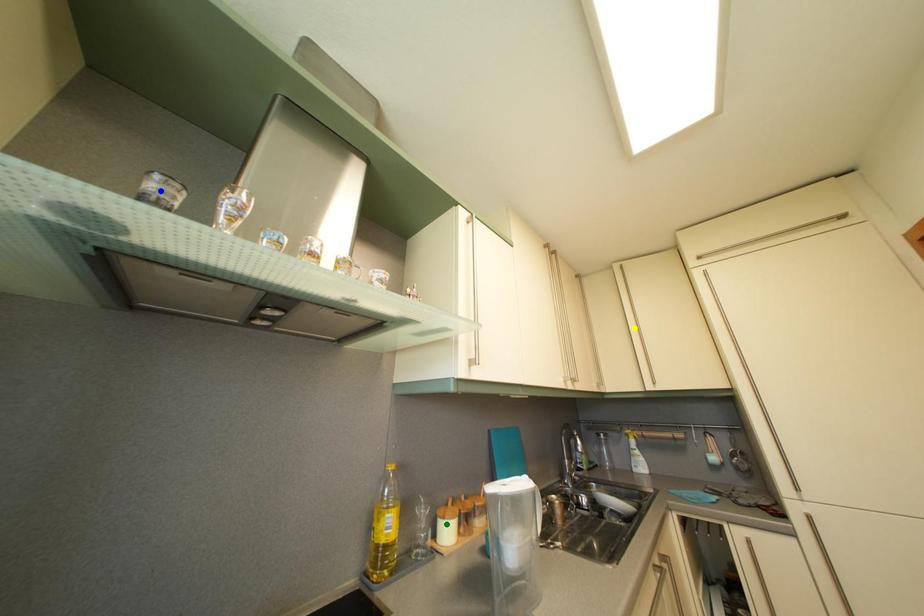
Order these from nearest to farthest:
A) blue point
B) yellow point
C) green point

1. blue point
2. green point
3. yellow point